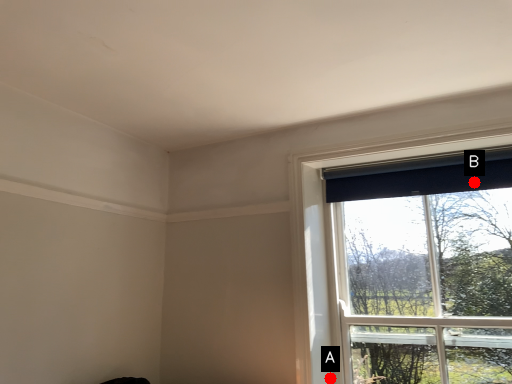
Question: Two points are circled on the image, labeled by A and B beside each circle. Which point appears closest to the camera in this image?

Choices:
 (A) A is closer
 (B) B is closer

Answer: (B)